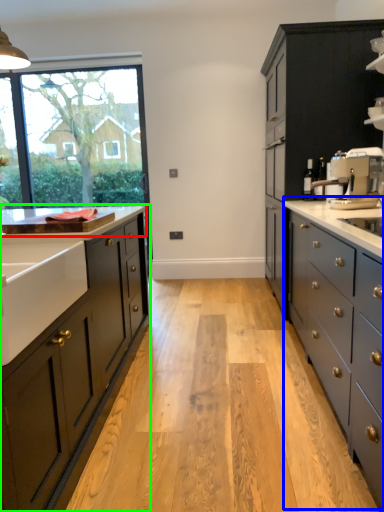
Question: Estimate the real-world distances between objects in this image. Which object is closer to countertop (highlighted by a red box), counter (highlighted by a blue box) or cabinetry (highlighted by a green box)?

Choices:
 (A) counter
 (B) cabinetry

Answer: (B)